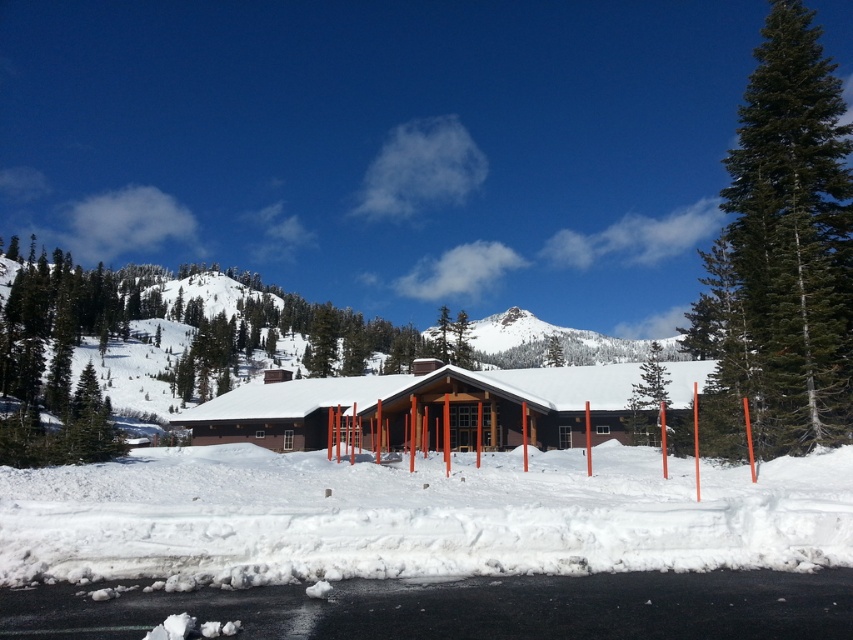
Question: Can you confirm if green textured pine tree at right is positioned to the right of green textured pine tree at center?

Choices:
 (A) no
 (B) yes

Answer: (A)

Question: Is green textured pine tree at right smaller than brown wooden cabin at center?

Choices:
 (A) yes
 (B) no

Answer: (A)

Question: Which of the following is the closest to the observer?

Choices:
 (A) brown wooden cabin at center
 (B) green textured pine tree at right

Answer: (B)

Question: Which of the following is the closest to the observer?

Choices:
 (A) green textured pine tree at center
 (B) green textured pine tree at right
 (C) brown wooden cabin at center

Answer: (B)

Question: Can you confirm if green textured pine tree at right is smaller than green textured pine tree at center?

Choices:
 (A) no
 (B) yes

Answer: (B)

Question: Among these objects, which one is nearest to the camera?

Choices:
 (A) green textured pine tree at right
 (B) brown wooden cabin at center
 (C) green textured pine tree at center

Answer: (A)